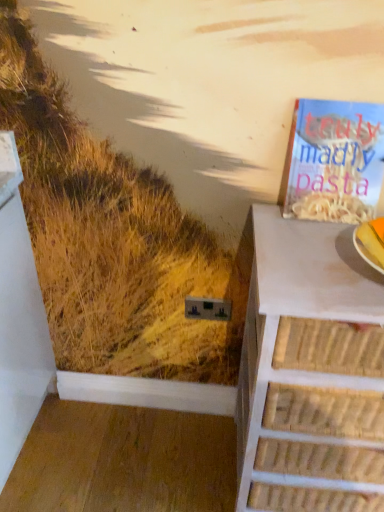
Question: Should I look upward or downward to see white wicker chest of drawers at right?

Choices:
 (A) up
 (B) down

Answer: (B)

Question: Considering the relative positions of matte paper book at upper right and white wicker chest of drawers at right in the image provided, is matte paper book at upper right to the left of white wicker chest of drawers at right from the viewer's perspective?

Choices:
 (A) yes
 (B) no

Answer: (A)

Question: Is matte paper book at upper right located outside white wicker chest of drawers at right?

Choices:
 (A) no
 (B) yes

Answer: (B)

Question: Does matte paper book at upper right lie behind white wicker chest of drawers at right?

Choices:
 (A) no
 (B) yes

Answer: (B)

Question: Can you confirm if matte paper book at upper right is positioned to the right of white wicker chest of drawers at right?

Choices:
 (A) no
 (B) yes

Answer: (A)

Question: Does matte paper book at upper right have a lesser width compared to white wicker chest of drawers at right?

Choices:
 (A) no
 (B) yes

Answer: (B)

Question: Considering the relative sizes of matte paper book at upper right and white wicker chest of drawers at right in the image provided, is matte paper book at upper right smaller than white wicker chest of drawers at right?

Choices:
 (A) no
 (B) yes

Answer: (B)

Question: From the image's perspective, is white wicker chest of drawers at right over matte paper book at upper right?

Choices:
 (A) no
 (B) yes

Answer: (A)

Question: From a real-world perspective, is white wicker chest of drawers at right below matte paper book at upper right?

Choices:
 (A) yes
 (B) no

Answer: (A)

Question: Would you say white wicker chest of drawers at right contains matte paper book at upper right?

Choices:
 (A) no
 (B) yes

Answer: (A)

Question: Considering the relative sizes of white wicker chest of drawers at right and matte paper book at upper right in the image provided, is white wicker chest of drawers at right taller than matte paper book at upper right?

Choices:
 (A) no
 (B) yes

Answer: (B)

Question: Is white wicker chest of drawers at right wider than matte paper book at upper right?

Choices:
 (A) no
 (B) yes

Answer: (B)

Question: Is white wicker chest of drawers at right not inside matte paper book at upper right?

Choices:
 (A) yes
 (B) no

Answer: (A)

Question: From the image's perspective, relative to matte paper book at upper right, is white wicker chest of drawers at right above or below?

Choices:
 (A) below
 (B) above

Answer: (A)